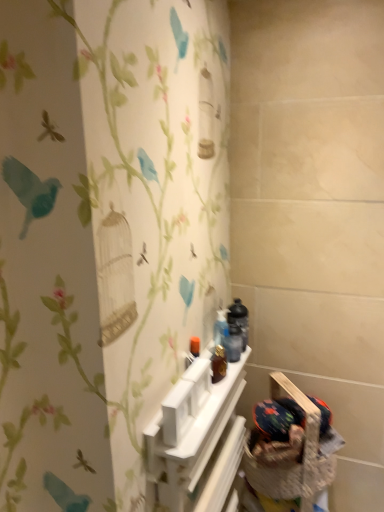
Question: Do you think fluffy fabric basket at lower right is within white plastic shelf at center, or outside of it?

Choices:
 (A) outside
 (B) inside

Answer: (A)

Question: Is point coord(327,479) closer or farther from the camera than point coord(205,436)?

Choices:
 (A) closer
 (B) farther

Answer: (B)

Question: From the image's perspective, relative to white plastic shelf at center, is fluffy fabric basket at lower right above or below?

Choices:
 (A) below
 (B) above

Answer: (B)

Question: Is white plastic shelf at center in front of or behind fluffy fabric basket at lower right in the image?

Choices:
 (A) behind
 (B) front

Answer: (B)

Question: From the image's perspective, is white plastic shelf at center located above or below fluffy fabric basket at lower right?

Choices:
 (A) above
 (B) below

Answer: (B)

Question: In terms of width, does white plastic shelf at center look wider or thinner when compared to fluffy fabric basket at lower right?

Choices:
 (A) wide
 (B) thin

Answer: (B)

Question: In terms of size, does white plastic shelf at center appear bigger or smaller than fluffy fabric basket at lower right?

Choices:
 (A) big
 (B) small

Answer: (A)